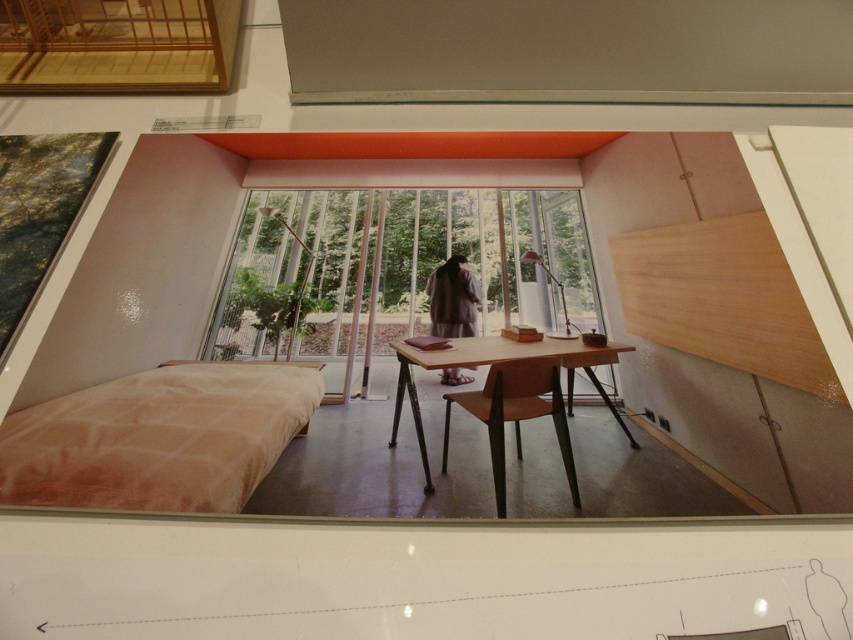
Is wooden chair at center thinner than wooden table at center?

Indeed, wooden chair at center has a lesser width compared to wooden table at center.

Who is shorter, wooden chair at center or wooden table at center?

wooden chair at center

Who is more distant from viewer, (503, 506) or (457, 349)?

The point (457, 349) is behind.

This screenshot has width=853, height=640. Identify the location of wooden chair at center. (515, 413).

Which of these two, satin beige bed at lower left or wooden table at center, stands taller?

wooden table at center is taller.

Measure the distance from satin beige bed at lower left to wooden table at center.

satin beige bed at lower left and wooden table at center are 76.86 centimeters apart from each other.

Is point (263, 476) closer to camera compared to point (492, 340)?

Yes, it is in front of point (492, 340).

This screenshot has height=640, width=853. I want to click on satin beige bed at lower left, so click(157, 438).

Between satin beige bed at lower left and wooden chair at center, which one appears on the left side from the viewer's perspective?

satin beige bed at lower left is more to the left.

Measure the distance between satin beige bed at lower left and wooden chair at center.

satin beige bed at lower left and wooden chair at center are 28.04 inches apart.

I want to click on satin beige bed at lower left, so click(157, 438).

Identify the location of satin beige bed at lower left. point(157,438).